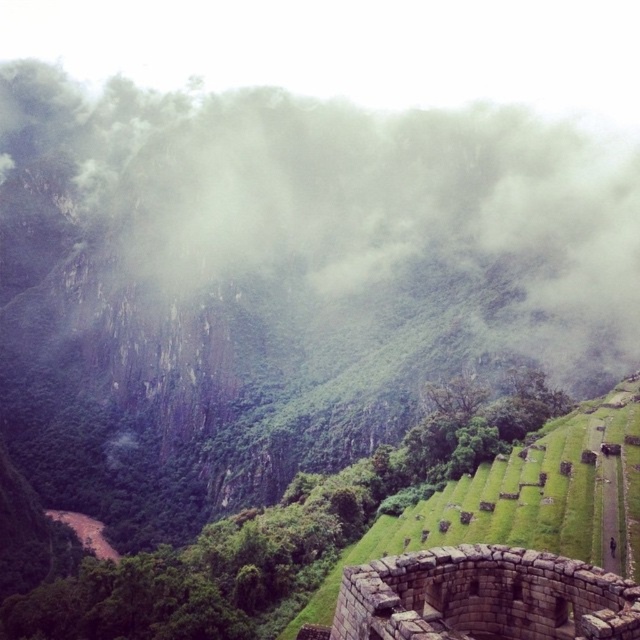
You are a hiker standing at the stone wall at lower right looking towards the foggy misty mountain at upper center. Is the mountain higher or lower in the sky compared to the stone wall?

The foggy misty mountain at upper center is above the stone wall at lower right, so it is higher in the sky.

You are a hiker standing at the stone structure in the foreground of the mountain landscape. You notice two points marked on your map at coordinates point (476, 134) and point (500, 556). Which point is closer to you?

Point (476, 134) is closer to you because it is further to the viewer than point (500, 556).

You are standing at the stone structure in the foreground of the mountain landscape. You notice a point marked at coordinates (x=339, y=212). What does this point indicate in the scene?

The point at coordinates (x=339, y=212) corresponds to the foggy misty mountain at upper center.